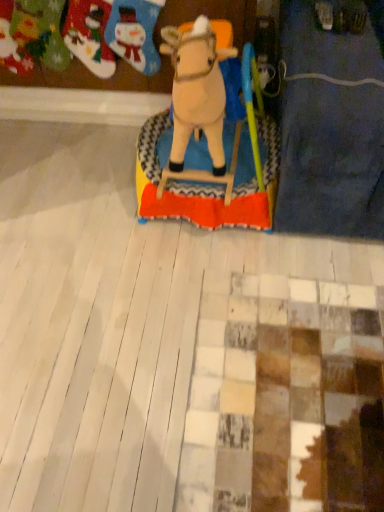
Question: Is felt stockings at upper left, placed as the third toy when sorted from right to left, oriented away from beige plush horse at center, which appears as the first toy when viewed from the right?

Choices:
 (A) yes
 (B) no

Answer: (B)

Question: Does felt stockings at upper left, placed as the first toy when sorted from left to right, have a smaller size compared to beige plush horse at center, the 3th toy in the left-to-right sequence?

Choices:
 (A) no
 (B) yes

Answer: (B)

Question: Is felt stockings at upper left, placed as the first toy when sorted from left to right, at the left side of beige plush horse at center, the 3th toy in the left-to-right sequence?

Choices:
 (A) no
 (B) yes

Answer: (B)

Question: Is felt stockings at upper left, placed as the third toy when sorted from right to left, wider than beige plush horse at center, which appears as the first toy when viewed from the right?

Choices:
 (A) yes
 (B) no

Answer: (B)

Question: Is beige plush horse at center, which appears as the first toy when viewed from the right, inside felt stockings at upper left, placed as the third toy when sorted from right to left?

Choices:
 (A) yes
 (B) no

Answer: (B)

Question: From the image's perspective, is felt stockings at upper left, placed as the third toy when sorted from right to left, above beige plush horse at center, which appears as the first toy when viewed from the right?

Choices:
 (A) yes
 (B) no

Answer: (A)

Question: Is felt stocking at upper left, arranged as the second toy when viewed from the right, thinner than beige plush horse at center, which appears as the first toy when viewed from the right?

Choices:
 (A) yes
 (B) no

Answer: (A)

Question: Are felt stocking at upper left, which is the 2th toy from left to right, and beige plush horse at center, which appears as the first toy when viewed from the right, far apart?

Choices:
 (A) yes
 (B) no

Answer: (B)

Question: From a real-world perspective, is felt stocking at upper left, which is the 2th toy from left to right, located beneath beige plush horse at center, the 3th toy in the left-to-right sequence?

Choices:
 (A) yes
 (B) no

Answer: (A)

Question: From the image's perspective, would you say felt stocking at upper left, which is the 2th toy from left to right, is positioned over beige plush horse at center, which appears as the first toy when viewed from the right?

Choices:
 (A) no
 (B) yes

Answer: (B)

Question: From the image's perspective, is felt stocking at upper left, arranged as the second toy when viewed from the right, located beneath beige plush horse at center, which appears as the first toy when viewed from the right?

Choices:
 (A) yes
 (B) no

Answer: (B)

Question: Is felt stocking at upper left, which is the 2th toy from left to right, outside of beige plush horse at center, the 3th toy in the left-to-right sequence?

Choices:
 (A) yes
 (B) no

Answer: (A)

Question: Considering the relative sizes of felt stockings at upper left, placed as the third toy when sorted from right to left, and felt stocking at upper left, arranged as the second toy when viewed from the right, in the image provided, is felt stockings at upper left, placed as the third toy when sorted from right to left, thinner than felt stocking at upper left, arranged as the second toy when viewed from the right,?

Choices:
 (A) no
 (B) yes

Answer: (A)